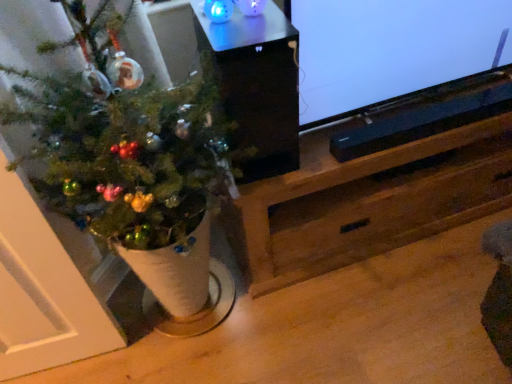
What is the approximate width of black plastic soundbar at lower center?

It is 4.57 inches.

What do you see at coordinates (124, 154) in the screenshot?
I see `green matte christmas tree at left` at bounding box center [124, 154].

What are the coordinates of `matte black speaker at upper right` in the screenshot? It's located at (391, 49).

You are a GUI agent. You are given a task and a screenshot of the screen. Output one action in this format:
    pyautogui.click(x=<x>, y=<y>)
    Task: Click on the black glossy speaker at upper center
    Image resolution: width=512 pixels, height=384 pixels.
    Given the screenshot: What is the action you would take?
    pyautogui.click(x=257, y=86)

Does green matte christmas tree at left have a greater width compared to black plastic soundbar at lower center?

A: Correct, the width of green matte christmas tree at left exceeds that of black plastic soundbar at lower center.

Is green matte christmas tree at left to the left or to the right of black plastic soundbar at lower center in the image?

green matte christmas tree at left is positioned on black plastic soundbar at lower center's left side.

Based on the photo, considering the sizes of objects green matte christmas tree at left and black plastic soundbar at lower center in the image provided, who is taller, green matte christmas tree at left or black plastic soundbar at lower center?

With more height is green matte christmas tree at left.

Is green matte christmas tree at left completely or partially outside of black plastic soundbar at lower center?

Yes.

Is black glossy speaker at upper center taller than green matte christmas tree at left?

Incorrect, the height of black glossy speaker at upper center is not larger of that of green matte christmas tree at left.

Does black glossy speaker at upper center have a smaller size compared to green matte christmas tree at left?

Correct, black glossy speaker at upper center occupies less space than green matte christmas tree at left.

Is black glossy speaker at upper center facing towards green matte christmas tree at left?

No, black glossy speaker at upper center does not turn towards green matte christmas tree at left.

Is there a large distance between black glossy speaker at upper center and green matte christmas tree at left?

black glossy speaker at upper center is actually quite close to green matte christmas tree at left.

Which of these two, black plastic soundbar at lower center or black glossy speaker at upper center, stands taller?

With more height is black glossy speaker at upper center.

From a real-world perspective, is black plastic soundbar at lower center physically located above or below black glossy speaker at upper center?

From a real-world perspective, black plastic soundbar at lower center is physically below black glossy speaker at upper center.

Is black glossy speaker at upper center at the back of black plastic soundbar at lower center?

No, black plastic soundbar at lower center is not facing the opposite direction of black glossy speaker at upper center.

Can you tell me how much black plastic soundbar at lower center and black glossy speaker at upper center differ in facing direction?

1.3 degrees.

Which object is more forward, matte black speaker at upper right or black glossy speaker at upper center?

black glossy speaker at upper center is closer to the camera.

Which is correct: matte black speaker at upper right is inside black glossy speaker at upper center, or outside of it?

matte black speaker at upper right lies outside black glossy speaker at upper center.

Image resolution: width=512 pixels, height=384 pixels. I want to click on television above the black glossy speaker at upper center (from the image's perspective), so click(391, 49).

From the image's perspective, relative to green matte christmas tree at left, is matte black speaker at upper right above or below?

matte black speaker at upper right is above green matte christmas tree at left.

From a real-world perspective, is matte black speaker at upper right above or below green matte christmas tree at left?

matte black speaker at upper right is above green matte christmas tree at left.

In the image, is matte black speaker at upper right positioned in front of or behind green matte christmas tree at left?

matte black speaker at upper right is behind green matte christmas tree at left.

Which object is further away from the camera taking this photo, black plastic soundbar at lower center or green matte christmas tree at left?

black plastic soundbar at lower center is more distant.

Does black plastic soundbar at lower center contain green matte christmas tree at left?

No, green matte christmas tree at left is not surrounded by black plastic soundbar at lower center.

In the scene shown: From the image's perspective, which object appears higher, black plastic soundbar at lower center or green matte christmas tree at left?

From the image's view, black plastic soundbar at lower center is above.

Considering the sizes of objects black plastic soundbar at lower center and green matte christmas tree at left in the image provided, who is bigger, black plastic soundbar at lower center or green matte christmas tree at left?

Bigger between the two is green matte christmas tree at left.

Is the depth of black glossy speaker at upper center greater than that of matte black speaker at upper right?

No, it is in front of matte black speaker at upper right.

From the image's perspective, is black glossy speaker at upper center below matte black speaker at upper right?

Yes, from the image's perspective, black glossy speaker at upper center is beneath matte black speaker at upper right.

Between black glossy speaker at upper center and matte black speaker at upper right, which one has smaller width?

With smaller width is matte black speaker at upper right.

Which is nearer, (x=200, y=21) or (x=433, y=61)?

The point (x=200, y=21) is closer to the camera.

Locate an element on the screen. Image resolution: width=512 pixels, height=384 pixels. wide beneath the green matte christmas tree at left (from a real-world perspective) is located at coordinates (429, 115).

The image size is (512, 384). Find the location of `table located above the green matte christmas tree at left (from a real-world perspective)`. table located above the green matte christmas tree at left (from a real-world perspective) is located at coordinates (257, 86).

Estimate the real-world distances between objects in this image. Which object is closer to black glossy speaker at upper center, matte black speaker at upper right or green matte christmas tree at left?

The object closer to black glossy speaker at upper center is green matte christmas tree at left.

Considering their positions, is black glossy speaker at upper center positioned closer to green matte christmas tree at left than matte black speaker at upper right?

black glossy speaker at upper center is closer to green matte christmas tree at left.

When comparing their distances from black plastic soundbar at lower center, does green matte christmas tree at left or matte black speaker at upper right seem closer?

matte black speaker at upper right lies closer to black plastic soundbar at lower center than the other object.

From the image, which object appears to be nearer to black glossy speaker at upper center, green matte christmas tree at left or black plastic soundbar at lower center?

Based on the image, green matte christmas tree at left appears to be nearer to black glossy speaker at upper center.

Estimate the real-world distances between objects in this image. Which object is closer to black glossy speaker at upper center, green matte christmas tree at left or matte black speaker at upper right?

green matte christmas tree at left is closer to black glossy speaker at upper center.

Considering their positions, is black glossy speaker at upper center positioned further to matte black speaker at upper right than green matte christmas tree at left?

Among the two, green matte christmas tree at left is located further to matte black speaker at upper right.

From the image, which object appears to be nearer to green matte christmas tree at left, black glossy speaker at upper center or black plastic soundbar at lower center?

black glossy speaker at upper center lies closer to green matte christmas tree at left than the other object.

Estimate the real-world distances between objects in this image. Which object is further from matte black speaker at upper right, black glossy speaker at upper center or black plastic soundbar at lower center?

black glossy speaker at upper center lies further to matte black speaker at upper right than the other object.

Identify the location of table located between green matte christmas tree at left and black plastic soundbar at lower center in the left-right direction. (257, 86).

The height and width of the screenshot is (384, 512). I want to click on television situated between black glossy speaker at upper center and black plastic soundbar at lower center from left to right, so click(x=391, y=49).

Find the location of `table situated between green matte christmas tree at left and matte black speaker at upper right from left to right`. table situated between green matte christmas tree at left and matte black speaker at upper right from left to right is located at coordinates (257, 86).

The width and height of the screenshot is (512, 384). I want to click on television situated between green matte christmas tree at left and black plastic soundbar at lower center from left to right, so click(391, 49).